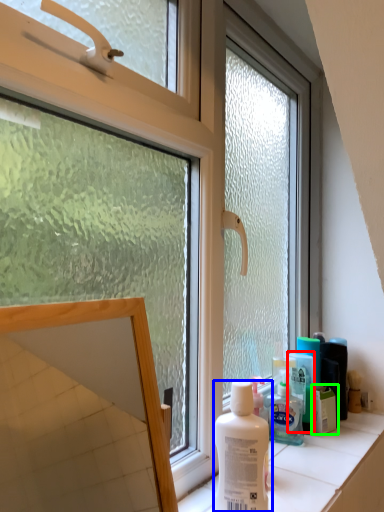
Question: Which object is positioned closest to mouthwash (highlighted by a red box)? Select from bottle (highlighted by a blue box) and product (highlighted by a green box).

Choices:
 (A) bottle
 (B) product

Answer: (B)